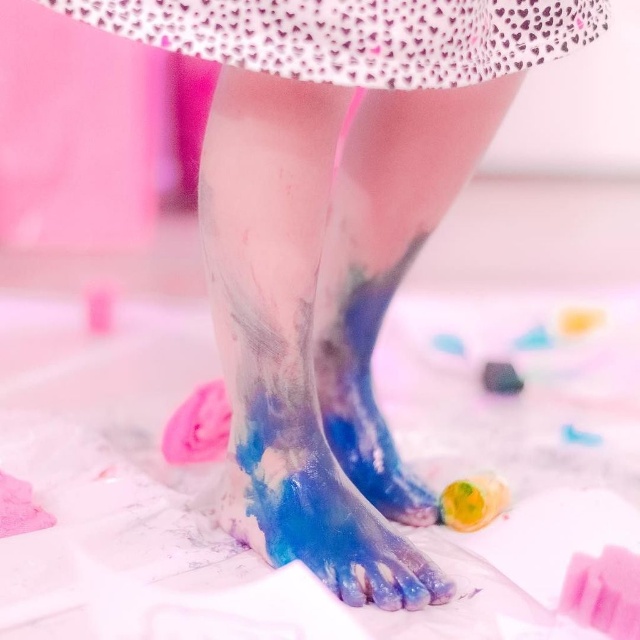
Who is taller, shiny blue paint at lower center or blue glossy foot at center?

Standing taller between the two is blue glossy foot at center.

Which is above, shiny blue paint at lower center or blue glossy foot at center?

blue glossy foot at center is above.

Locate an element on the screen. shiny blue paint at lower center is located at coordinates (323, 525).

The width and height of the screenshot is (640, 640). I want to click on shiny blue paint at lower center, so click(323, 525).

Can you confirm if white dotted fabric at upper center is positioned below blue glossy foot at center?

Incorrect, white dotted fabric at upper center is not positioned below blue glossy foot at center.

This screenshot has height=640, width=640. What do you see at coordinates (356, 35) in the screenshot?
I see `white dotted fabric at upper center` at bounding box center [356, 35].

Where is `white dotted fabric at upper center`? The image size is (640, 640). white dotted fabric at upper center is located at coordinates (356, 35).

Can you confirm if white dotted fabric at upper center is taller than shiny blue paint at lower center?

No, white dotted fabric at upper center is not taller than shiny blue paint at lower center.

Between point (387, 42) and point (273, 564), which one is positioned behind?

The point (273, 564) is behind.

Locate an element on the screen. white dotted fabric at upper center is located at coordinates (356, 35).